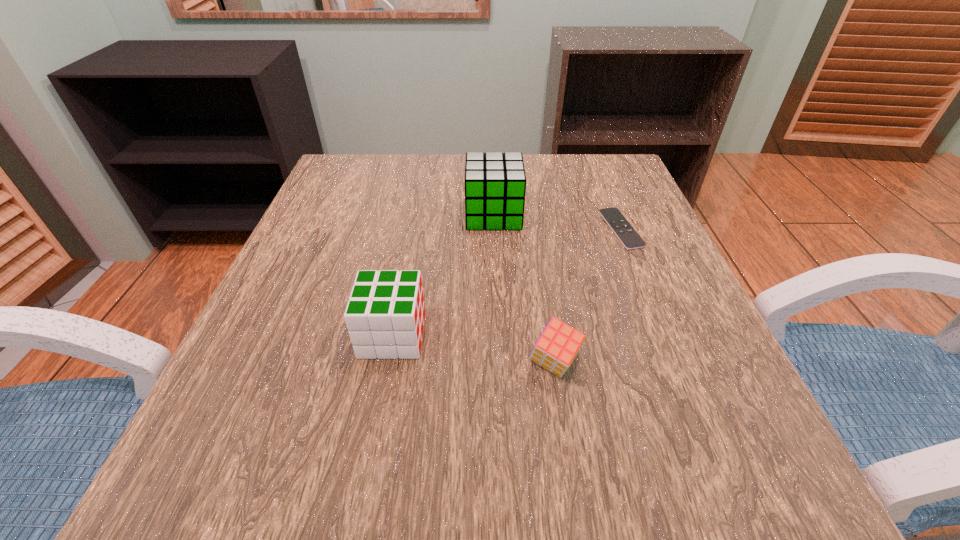
I want to click on the third closest object to the third tallest object, so 495,183.

Locate an element on the screen. The image size is (960, 540). cube object that ranks as the second closest to the second tallest object is located at coordinates (495, 183).

Select which cube is the closest to the shortest cube. Please provide its 2D coordinates. Your answer should be formatted as a tuple, i.e. [(x, y)], where the tuple contains the x and y coordinates of a point satisfying the conditions above.

[(385, 314)]

Where is `vacant area in the image that satisfies the following two spatial constraints: 1. on the front side of the shortest object; 2. on the red face of the second tallest object`? vacant area in the image that satisfies the following two spatial constraints: 1. on the front side of the shortest object; 2. on the red face of the second tallest object is located at coordinates coord(663,335).

Find the location of `free space that satisfies the following two spatial constraints: 1. on the front side of the tallest cube; 2. on the right side of the remote control`. free space that satisfies the following two spatial constraints: 1. on the front side of the tallest cube; 2. on the right side of the remote control is located at coordinates (494, 229).

Where is `vacant space that satisfies the following two spatial constraints: 1. on the front side of the tallest object; 2. on the left side of the rightmost object`? This screenshot has height=540, width=960. vacant space that satisfies the following two spatial constraints: 1. on the front side of the tallest object; 2. on the left side of the rightmost object is located at coordinates (494, 229).

Image resolution: width=960 pixels, height=540 pixels. In order to click on vacant position in the image that satisfies the following two spatial constraints: 1. on the red face of the leftmost object; 2. on the back side of the shortest cube in this screenshot , I will do `click(387, 363)`.

Where is `vacant region that satisfies the following two spatial constraints: 1. on the front side of the farthest cube; 2. on the right side of the second shortest object`? Image resolution: width=960 pixels, height=540 pixels. vacant region that satisfies the following two spatial constraints: 1. on the front side of the farthest cube; 2. on the right side of the second shortest object is located at coordinates (499, 363).